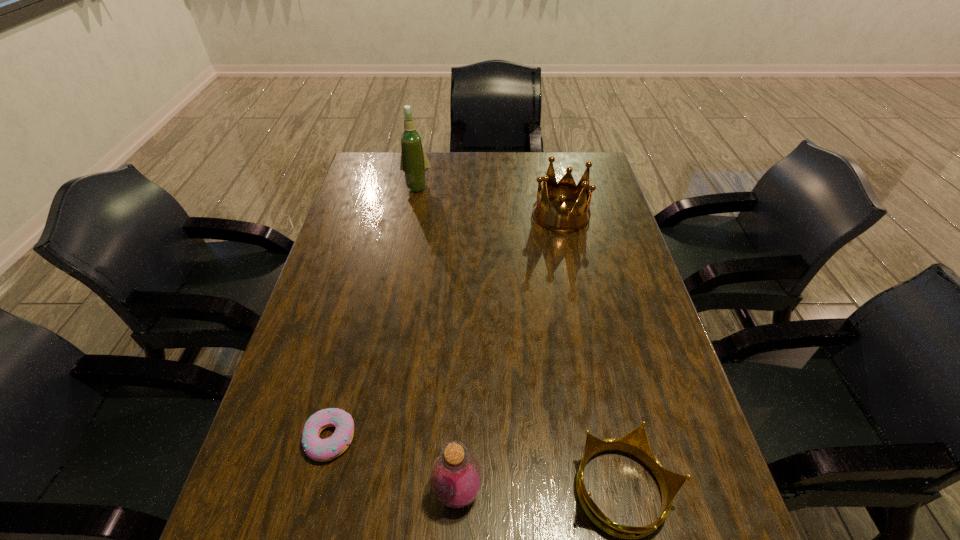
The image size is (960, 540). I want to click on object that is at the far edge, so pos(414,163).

At what (x,y) coordinates should I click in order to perform the action: click on object present at the left edge. Please return your answer as a coordinate pair (x, y). The width and height of the screenshot is (960, 540). Looking at the image, I should click on (322, 450).

This screenshot has height=540, width=960. In order to click on object that is positioned at the right edge in this screenshot , I will do `click(558, 219)`.

You are a GUI agent. You are given a task and a screenshot of the screen. Output one action in this format:
    pyautogui.click(x=<x>, y=<y>)
    Task: Click on the free space at the left edge
    The width and height of the screenshot is (960, 540).
    Given the screenshot: What is the action you would take?
    pyautogui.click(x=349, y=280)

In the image, there is a desktop. Where is `free region at the right edge`? This screenshot has height=540, width=960. free region at the right edge is located at coordinates (611, 382).

At what (x,y) coordinates should I click in order to perform the action: click on vacant point at the far right corner. Please return your answer as a coordinate pair (x, y). Looking at the image, I should click on (582, 173).

Locate an element on the screen. empty space that is in between the third object from right to left and the farther crown is located at coordinates (509, 353).

I want to click on free space between the doughnut and the farthest object, so click(373, 312).

Identify the location of free space between the taller crown and the shortest object. This screenshot has width=960, height=540. (445, 327).

The image size is (960, 540). I want to click on empty location between the farther crown and the shortest object, so click(445, 327).